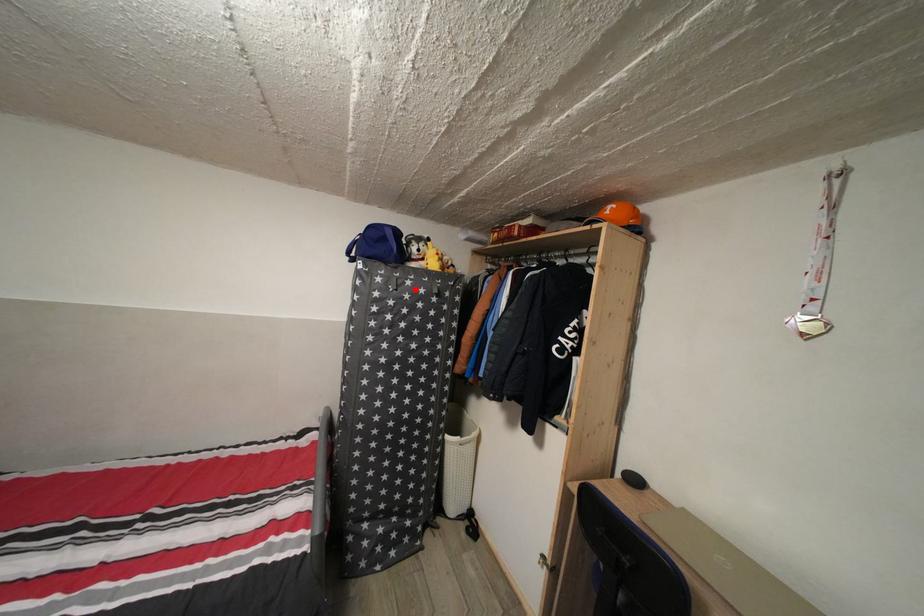
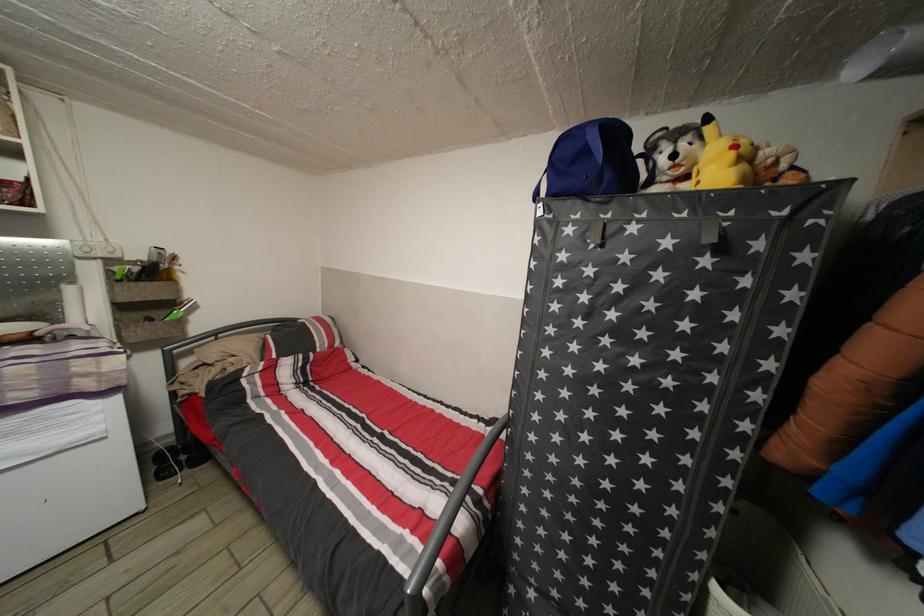
The point at the highlighted location is marked in the first image. Where is the corresponding point in the second image?

(639, 235)